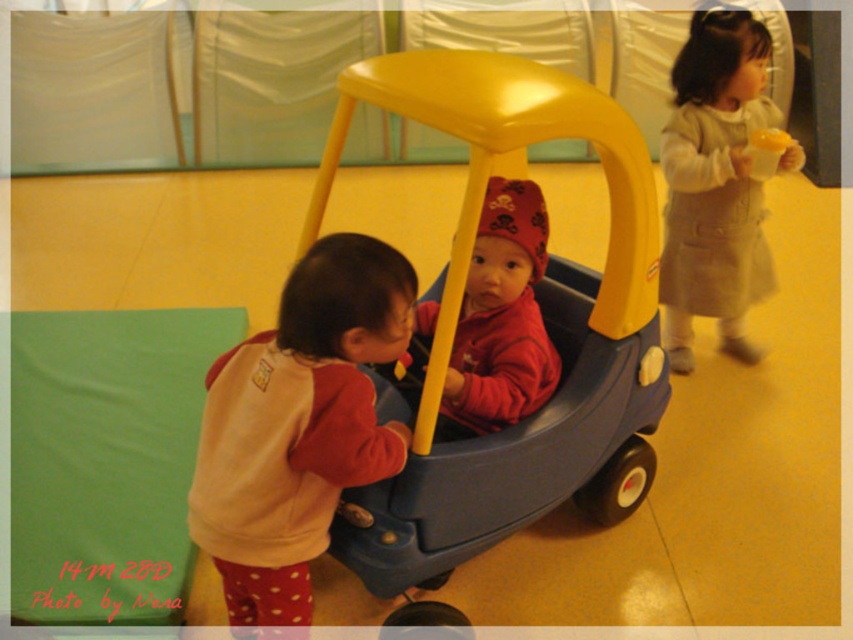
You are a parent trying to choose between two outfits for your child. The beige woolen dress at upper right and the matte red hoodie at center are both available. Which one is larger in size?

The beige woolen dress at upper right is bigger than the matte red hoodie at center, so the beige woolen dress at upper right is the larger option.

You are organizing a charity event and need to arrange two beige items in a display case. The items are the beige fleece sweater at left and the beige woolen dress at upper right. Based on their sizes, which item should you place first to maximize space efficiency?

The beige fleece sweater at left occupies less space than the beige woolen dress at upper right, so place the beige fleece sweater at left first to maximize space efficiency by utilizing smaller spaces first before larger items.